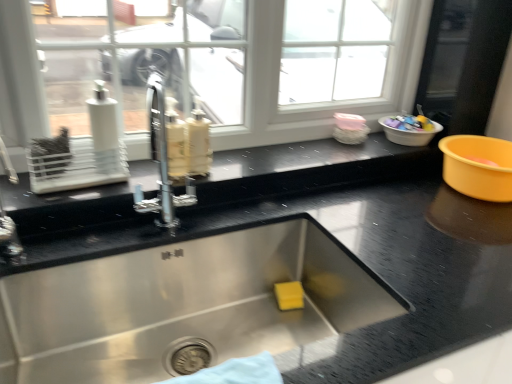
Question: Can you confirm if white plastic basin at upper right is shorter than black granite countertop at center?

Choices:
 (A) no
 (B) yes

Answer: (B)

Question: Can you confirm if white plastic basin at upper right is smaller than black granite countertop at center?

Choices:
 (A) no
 (B) yes

Answer: (B)

Question: Can you confirm if white plastic basin at upper right is thinner than black granite countertop at center?

Choices:
 (A) no
 (B) yes

Answer: (B)

Question: Does white plastic basin at upper right appear on the left side of black granite countertop at center?

Choices:
 (A) no
 (B) yes

Answer: (A)

Question: Are white plastic basin at upper right and black granite countertop at center far apart?

Choices:
 (A) yes
 (B) no

Answer: (B)

Question: Is black granite countertop at center at the back of white plastic basin at upper right?

Choices:
 (A) no
 (B) yes

Answer: (A)

Question: Is the depth of black granite countertop at center greater than that of white plastic basin at upper right?

Choices:
 (A) no
 (B) yes

Answer: (A)

Question: Can we say black granite countertop at center lies outside white plastic basin at upper right?

Choices:
 (A) yes
 (B) no

Answer: (A)

Question: Is black granite countertop at center oriented away from white plastic basin at upper right?

Choices:
 (A) no
 (B) yes

Answer: (A)

Question: Can you confirm if black granite countertop at center is smaller than white plastic basin at upper right?

Choices:
 (A) no
 (B) yes

Answer: (A)

Question: From the image's perspective, would you say black granite countertop at center is shown under white plastic basin at upper right?

Choices:
 (A) yes
 (B) no

Answer: (A)

Question: Considering the relative sizes of black granite countertop at center and white plastic basin at upper right in the image provided, is black granite countertop at center taller than white plastic basin at upper right?

Choices:
 (A) no
 (B) yes

Answer: (B)

Question: Considering the positions of point (436, 193) and point (384, 125), is point (436, 193) closer or farther from the camera than point (384, 125)?

Choices:
 (A) farther
 (B) closer

Answer: (B)